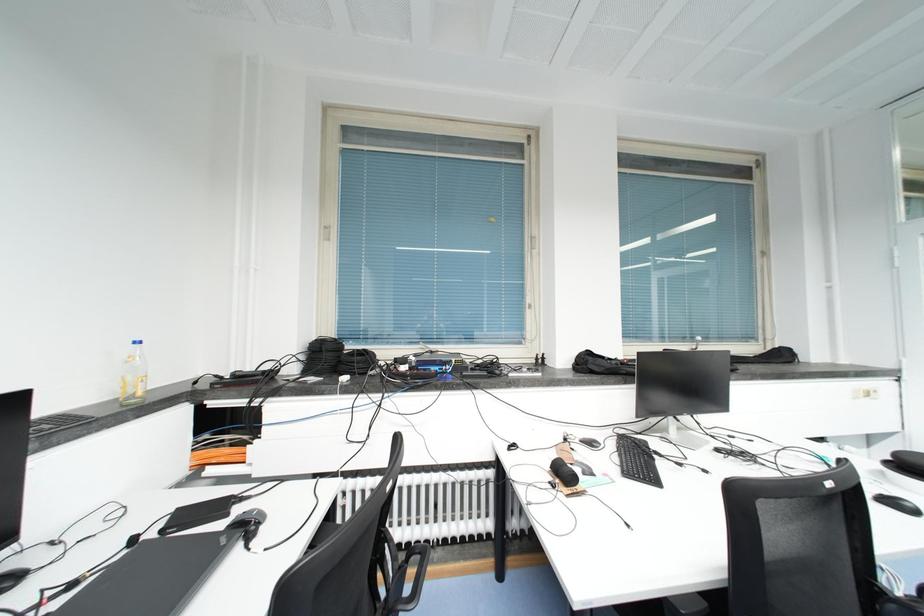
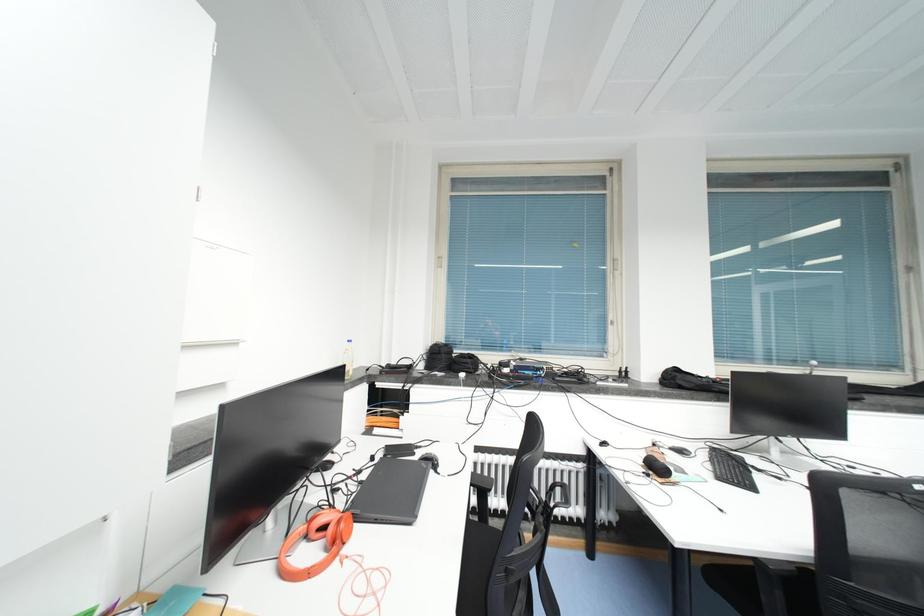
Question: The camera is either moving clockwise (left) or counter-clockwise (right) around the object. The first image is from the beginning of the video and the second image is from the end. Is the camera moving left or right when shooting the video?

Choices:
 (A) Left
 (B) Right

Answer: (B)